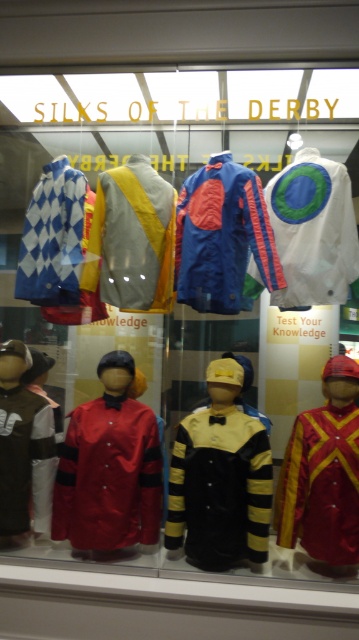
Does blue satin racing jacket at center come in front of white matte jacket at center?

Yes.

Locate an element on the screen. blue satin racing jacket at center is located at coordinates (221, 236).

Can you confirm if shiny red and gold jacket at center is taller than white matte jacket at center?

Correct, shiny red and gold jacket at center is much taller as white matte jacket at center.

Who is more distant from viewer, [295,496] or [319,209]?

Point [319,209]

Identify the location of shiny red and gold jacket at center. (324, 474).

In the scene shown: Is yellow and gray silk jockey jacket at center in front of white matte jacket at left?

No, it is behind white matte jacket at left.

Does point (143, 284) lie in front of point (0, 500)?

No.

Locate an element on the screen. yellow and gray silk jockey jacket at center is located at coordinates (132, 237).